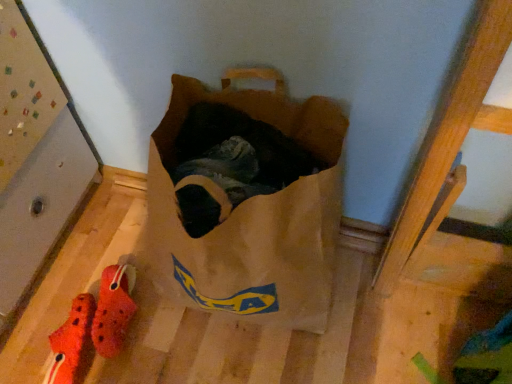
You are a GUI agent. You are given a task and a screenshot of the screen. Output one action in this format:
    pyautogui.click(x=<x>, y=<y>)
    Task: Click on the vacant region to the right of rubberized red croc at lower left, positioned as the first footwear in right-to-left order
    The width and height of the screenshot is (512, 384).
    Given the screenshot: What is the action you would take?
    pyautogui.click(x=186, y=336)